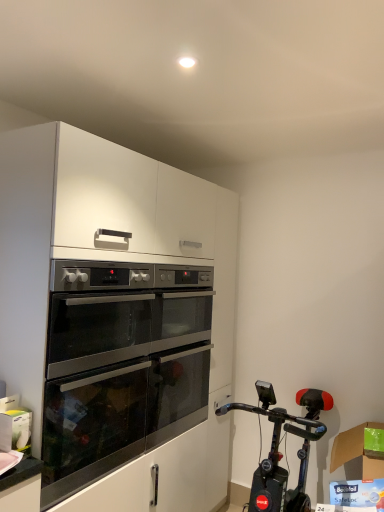
Identify the location of stainless steel oven at center. This screenshot has width=384, height=512. (121, 365).

What do you see at coordinates (121, 365) in the screenshot? I see `stainless steel oven at center` at bounding box center [121, 365].

This screenshot has width=384, height=512. What are the coordinates of `stainless steel oven at center` in the screenshot? It's located at (121, 365).